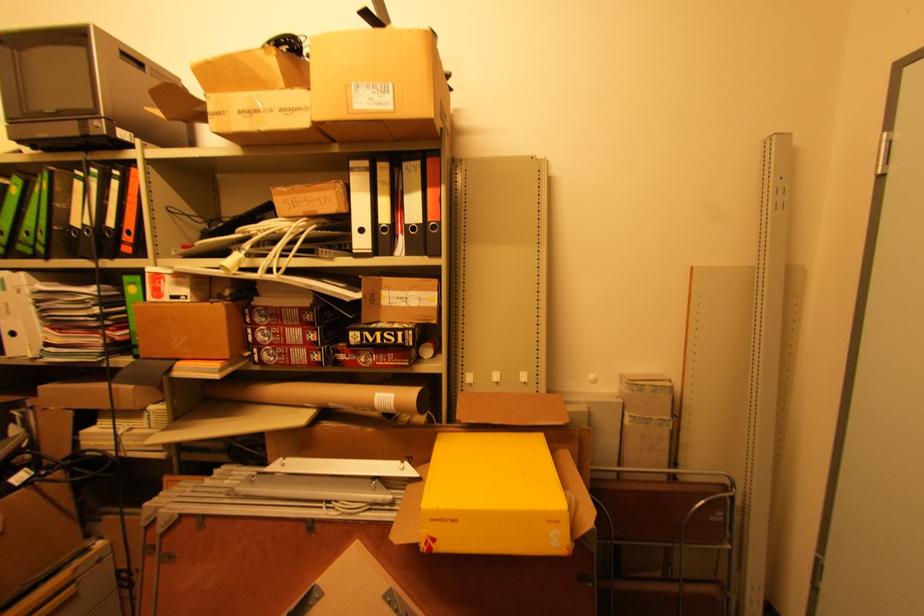
You are a GUI agent. You are given a task and a screenshot of the screen. Output one action in this format:
    pyautogui.click(x=<x>, y=<y>)
    Task: Click on the red and black box
    The width and height of the screenshot is (924, 616).
    Given the screenshot: What is the action you would take?
    pyautogui.click(x=286, y=334)